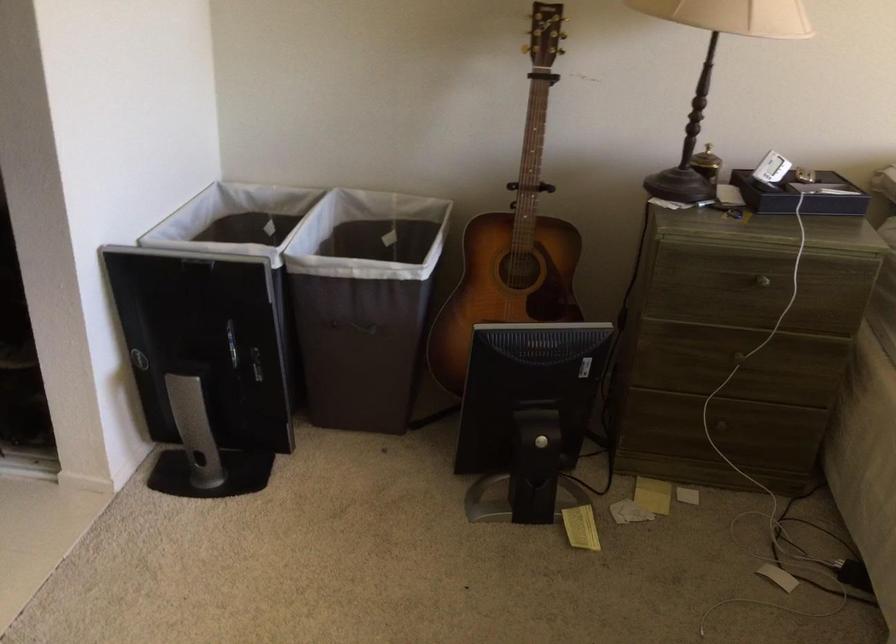
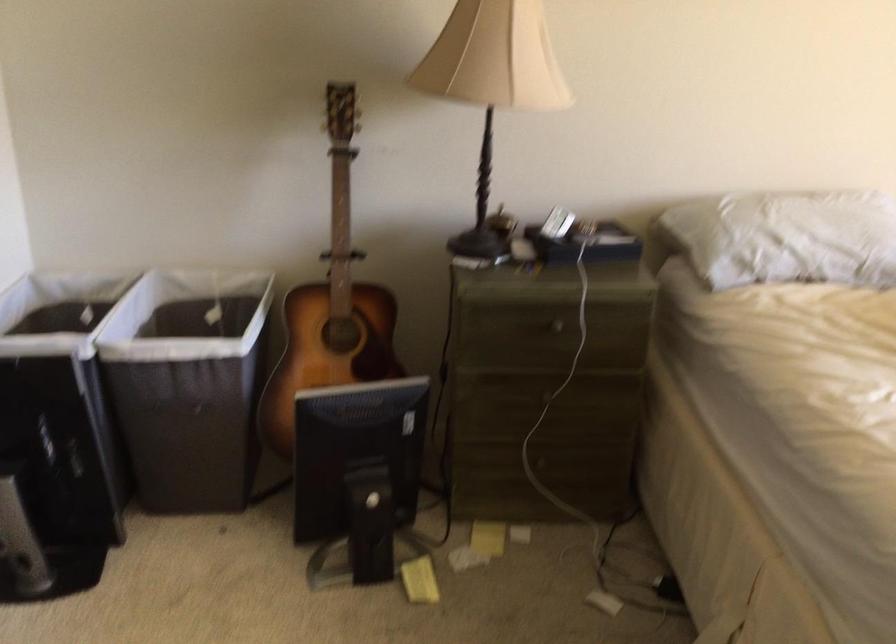
Locate, in the second image, the point that corresponds to the point at 242,220 in the first image.

(57, 310)